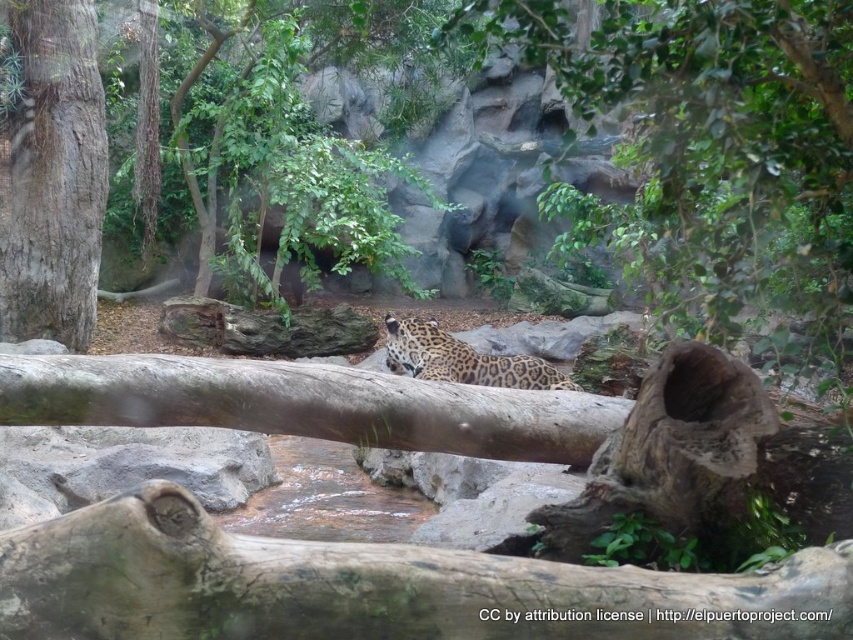
Question: Can you confirm if green leafy tree at center is thinner than smooth brown log at center?

Choices:
 (A) yes
 (B) no

Answer: (A)

Question: Does green leafy tree at center have a smaller size compared to rough bark tree trunk at left?

Choices:
 (A) no
 (B) yes

Answer: (A)

Question: Which of these objects is positioned farthest from the brown rough log at center?

Choices:
 (A) rough bark tree trunk at left
 (B) green leafy tree at center
 (C) spotted fur leopard at center

Answer: (A)

Question: Which of the following is the farthest from the observer?

Choices:
 (A) rough bark tree trunk at left
 (B) smooth brown log at center
 (C) brown rough log at center

Answer: (A)

Question: Based on their relative distances, which object is farther from the brown rough log at center?

Choices:
 (A) spotted fur leopard at center
 (B) rough bark tree trunk at left

Answer: (B)

Question: Can you confirm if smooth brown log at center is wider than brown rough log at center?

Choices:
 (A) no
 (B) yes

Answer: (A)